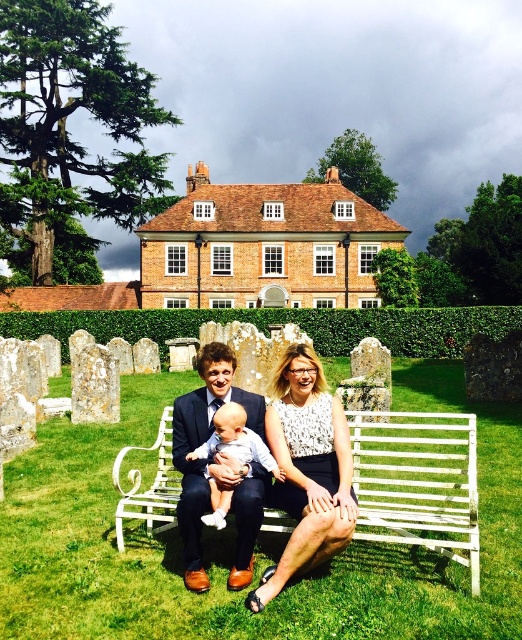
From the picture: You are a photographer trying to capture a family photo in the garden. You see the white metal bench at center and the light blue fabric baby at center. Which object should you focus on first if you want to ensure the baby is in the foreground of the photo?

The light blue fabric baby at center should be focused on first because it is positioned to the left of the white metal bench at center, making it closer to the camera and thus the foreground.

You are a photographer positioned at the edge of the grassy area near the hedge. You want to capture a photo of the matte black suit at center and the light blue fabric baby at center. How far apart are these two subjects from each other?

The matte black suit at center is 12.45 feet away from the light blue fabric baby at center, so the distance between them is 12.45 feet.

You are standing in the garden and want to reach the point marked at coordinates (144, 445). The distance from your current position to this point is 54.11 meters. If you walk straight towards it, will you be able to see the large brick building with the red roof behind the gravestones?

The point marked at coordinates (144, 445) is 54.11 meters away from you. Since the large brick building with the red roof is in the background behind the gravestones, walking straight towards the point may block your view of the building due to the gravestones being in between you and the building. However, the exact visibility depends on the arrangement of the gravestones and their height. If the gravestones are tall and dense, they might obstruct the view, but if they are shorter or spaced apart, you M